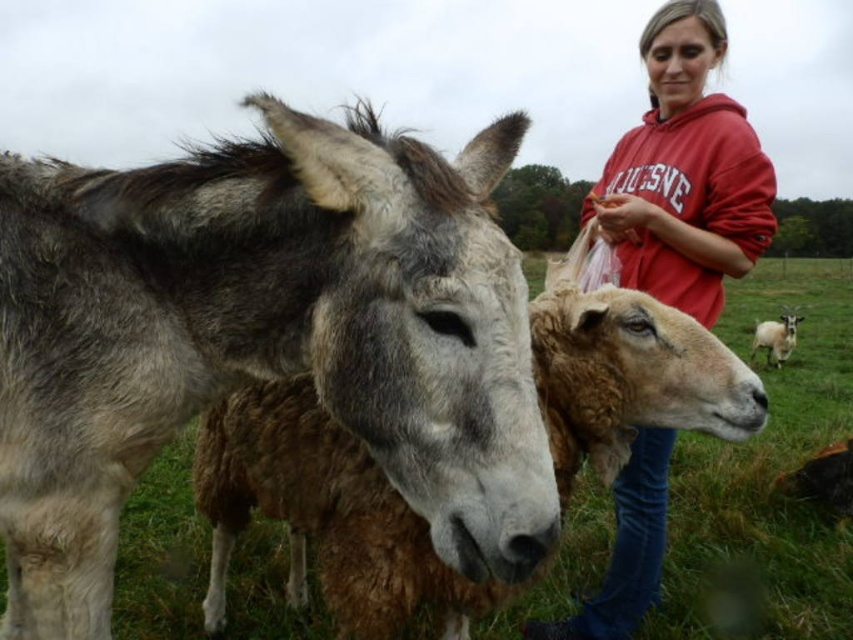
You are standing in the rural outdoor scene and want to place a small marker at the point that is closer to you. Which point should you choose between point (653, 412) and point (628, 461)?

Point (653, 412) is closer to the viewer, so you should place the marker there.

You are standing in the rural area and see the brown woolen sheep at center and the red cotton hoodie at upper right. Which object is positioned more to the left side?

The brown woolen sheep at center is positioned to the left of the red cotton hoodie at upper right, so it is more to the left side.